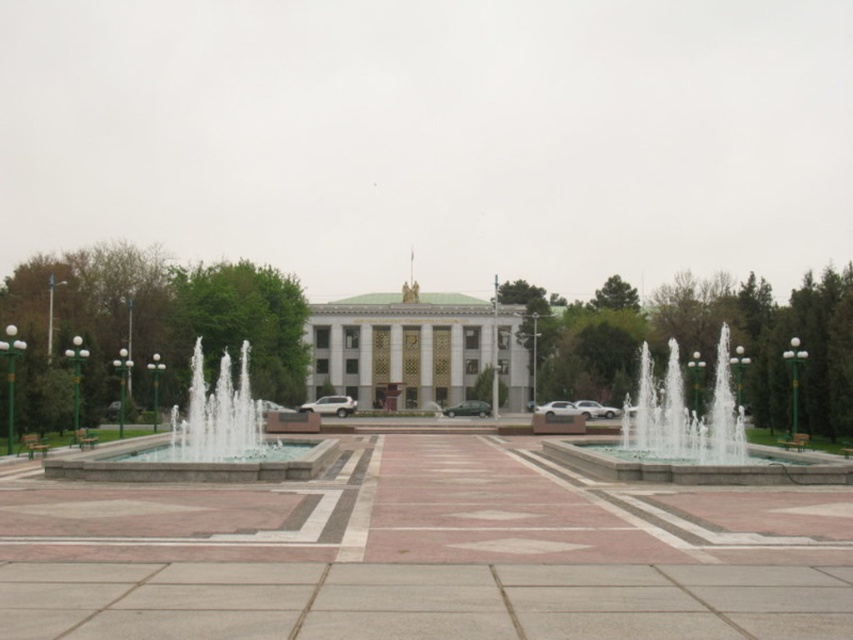
Which is below, green marble palace at center or clear glass water at center?

green marble palace at center is below.

Does green marble palace at center appear on the left side of clear glass water at center?

Indeed, green marble palace at center is positioned on the left side of clear glass water at center.

Locate an element on the screen. Image resolution: width=853 pixels, height=640 pixels. green marble palace at center is located at coordinates (416, 349).

What are the coordinates of `green marble palace at center` in the screenshot? It's located at (416, 349).

Is point (438, 324) farther from viewer compared to point (115, 460)?

Yes, it is.

Which is below, green marble palace at center or clear stone fountain at center?

green marble palace at center is below.

The height and width of the screenshot is (640, 853). In order to click on green marble palace at center in this screenshot , I will do `click(416, 349)`.

Where is `green marble palace at center`? green marble palace at center is located at coordinates (416, 349).

Based on the photo, is clear stone fountain at center taller than clear glass water at center?

No.

From the picture: Measure the distance between clear stone fountain at center and camera.

A distance of 61.54 feet exists between clear stone fountain at center and camera.

Where is `clear stone fountain at center`? clear stone fountain at center is located at coordinates (206, 440).